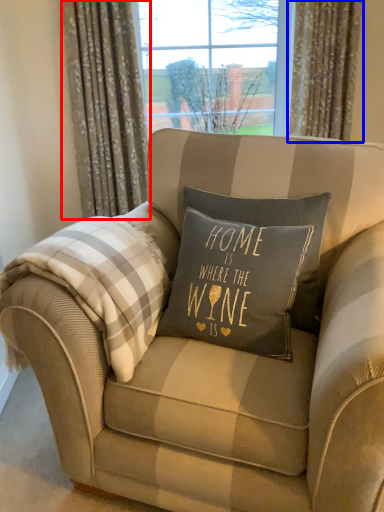
Question: Among these objects, which one is farthest to the camera, curtain (highlighted by a red box) or curtain (highlighted by a blue box)?

Choices:
 (A) curtain
 (B) curtain

Answer: (B)